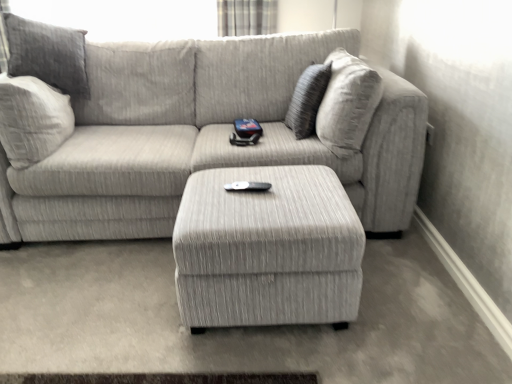
Question: Is beige fabric pillow at upper right bigger than textured gray ottoman at center?

Choices:
 (A) yes
 (B) no

Answer: (B)

Question: Can you confirm if beige fabric pillow at upper right is wider than textured gray ottoman at center?

Choices:
 (A) yes
 (B) no

Answer: (B)

Question: Can textured gray ottoman at center be found inside beige fabric pillow at upper right?

Choices:
 (A) no
 (B) yes

Answer: (A)

Question: Is beige fabric pillow at upper right in front of textured gray ottoman at center?

Choices:
 (A) yes
 (B) no

Answer: (B)

Question: Is beige fabric pillow at upper right not close to textured gray ottoman at center?

Choices:
 (A) no
 (B) yes

Answer: (A)

Question: From the image's perspective, would you say beige fabric pillow at upper right is positioned over textured gray ottoman at center?

Choices:
 (A) no
 (B) yes

Answer: (B)

Question: Is plaid fabric curtain at upper center touching textured gray couch at center?

Choices:
 (A) no
 (B) yes

Answer: (A)

Question: Considering the relative positions of plaid fabric curtain at upper center and textured gray couch at center in the image provided, is plaid fabric curtain at upper center to the left of textured gray couch at center from the viewer's perspective?

Choices:
 (A) no
 (B) yes

Answer: (A)

Question: Considering the relative positions of plaid fabric curtain at upper center and textured gray couch at center in the image provided, is plaid fabric curtain at upper center to the right of textured gray couch at center from the viewer's perspective?

Choices:
 (A) yes
 (B) no

Answer: (A)

Question: From a real-world perspective, is plaid fabric curtain at upper center positioned over textured gray couch at center based on gravity?

Choices:
 (A) yes
 (B) no

Answer: (A)

Question: Is plaid fabric curtain at upper center completely or partially outside of textured gray couch at center?

Choices:
 (A) yes
 (B) no

Answer: (A)

Question: Does plaid fabric curtain at upper center lie behind textured gray couch at center?

Choices:
 (A) yes
 (B) no

Answer: (A)

Question: Is textured gray couch at center not within plaid fabric curtain at upper center?

Choices:
 (A) no
 (B) yes

Answer: (B)